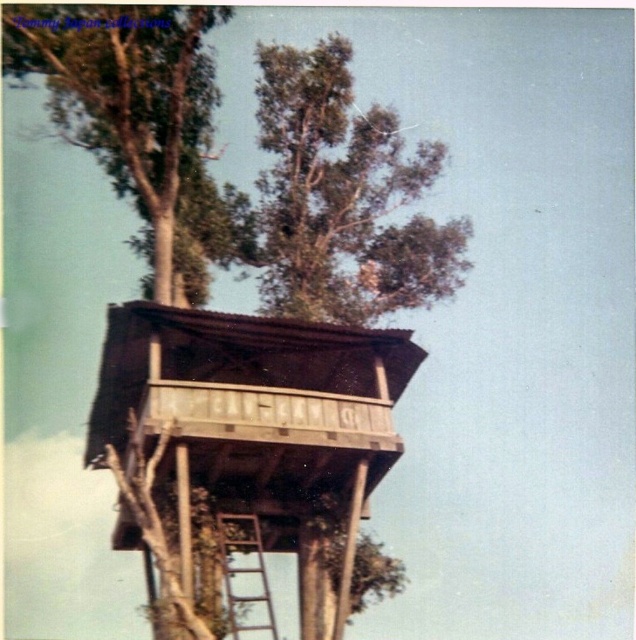
Question: In this image, where is brown wooden hut at upper center located relative to green leafy tree at upper center?

Choices:
 (A) right
 (B) left

Answer: (B)

Question: Which of the following is the farthest from the observer?

Choices:
 (A) (116, 147)
 (B) (314, 93)
 (C) (263, 572)
 (D) (328, 364)

Answer: (B)

Question: Which of these objects is positioned farthest from the brown wooden hut at upper center?

Choices:
 (A) wooden ladder at center
 (B) green leafy tree at upper center

Answer: (B)

Question: Considering the real-world distances, which object is closest to the green leafy tree at upper left?

Choices:
 (A) brown wooden hut at upper center
 (B) green leafy tree at upper center

Answer: (B)

Question: From the image, what is the correct spatial relationship of brown wooden hut at upper center in relation to green leafy tree at upper left?

Choices:
 (A) above
 (B) below

Answer: (B)

Question: Can you confirm if brown wooden hut at upper center is wider than green leafy tree at upper center?

Choices:
 (A) yes
 (B) no

Answer: (B)